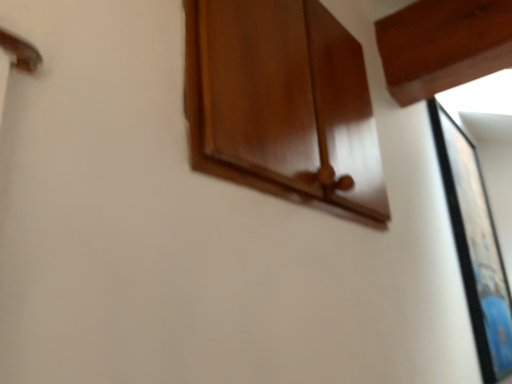
Question: In the image, is black glossy picture frame at right positioned in front of or behind glossy wood cabinet at upper center?

Choices:
 (A) front
 (B) behind

Answer: (B)

Question: Is black glossy picture frame at right bigger or smaller than glossy wood cabinet at upper center?

Choices:
 (A) small
 (B) big

Answer: (B)

Question: From the image's perspective, is black glossy picture frame at right above or below glossy wood cabinet at upper center?

Choices:
 (A) below
 (B) above

Answer: (A)

Question: Is glossy wood cabinet at upper center inside or outside of black glossy picture frame at right?

Choices:
 (A) inside
 (B) outside

Answer: (B)

Question: From a real-world perspective, relative to black glossy picture frame at right, is glossy wood cabinet at upper center vertically above or below?

Choices:
 (A) above
 (B) below

Answer: (A)

Question: Considering the positions of glossy wood cabinet at upper center and black glossy picture frame at right in the image, is glossy wood cabinet at upper center wider or thinner than black glossy picture frame at right?

Choices:
 (A) wide
 (B) thin

Answer: (B)

Question: Looking at the image, does glossy wood cabinet at upper center seem bigger or smaller compared to black glossy picture frame at right?

Choices:
 (A) big
 (B) small

Answer: (B)